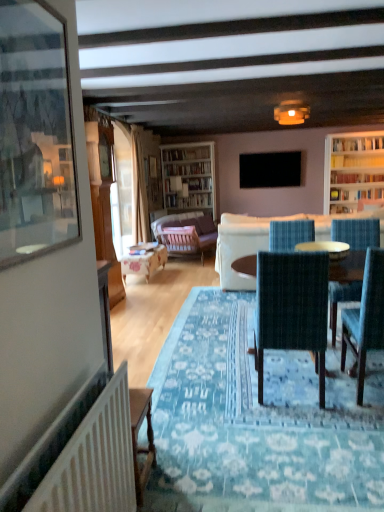
Question: From their relative heights in the image, would you say wooden desk at lower left is taller or shorter than white fabric couch at center, the 2th studio couch when ordered from back to front?

Choices:
 (A) short
 (B) tall

Answer: (A)

Question: In terms of size, does wooden desk at lower left appear bigger or smaller than white fabric couch at center, acting as the 1th studio couch starting from the front?

Choices:
 (A) small
 (B) big

Answer: (A)

Question: Which object is positioned closest to the wooden desk at lower left?

Choices:
 (A) velvet purple couch at center, arranged as the 1th studio couch when viewed from the back
 (B) clear glass picture frame at left
 (C) wooden table at center
 (D) white textured radiator at lower left
 (E) wooden round table at center

Answer: (D)

Question: Estimate the real-world distances between objects in this image. Which object is farther from the wooden desk at lower left?

Choices:
 (A) dark green fabric chair at center, placed as the second chair when sorted from right to left
 (B) black matte television at upper center
 (C) white fabric couch at center, the 2th studio couch when ordered from back to front
 (D) beige fabric curtain at left
 (E) clear glass picture frame at left

Answer: (B)